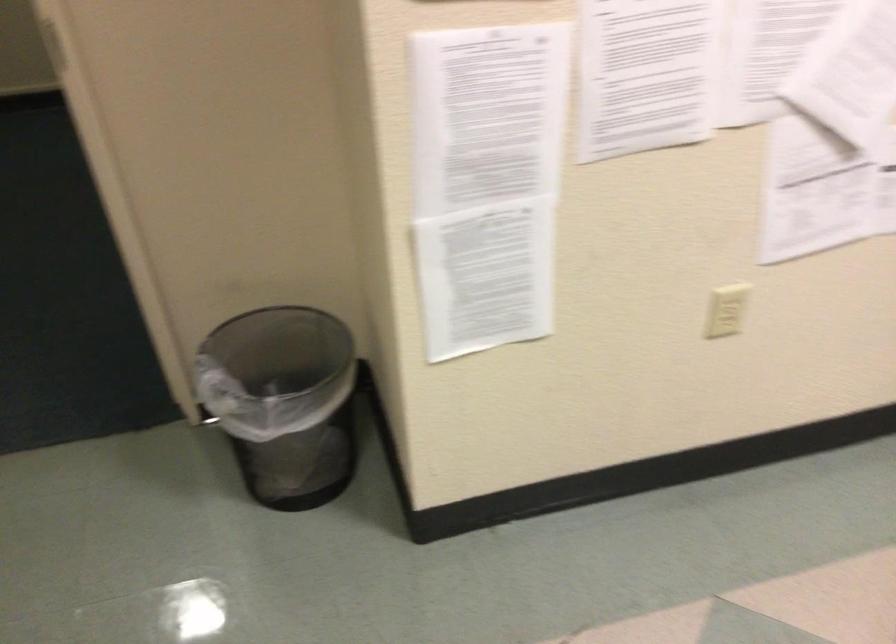
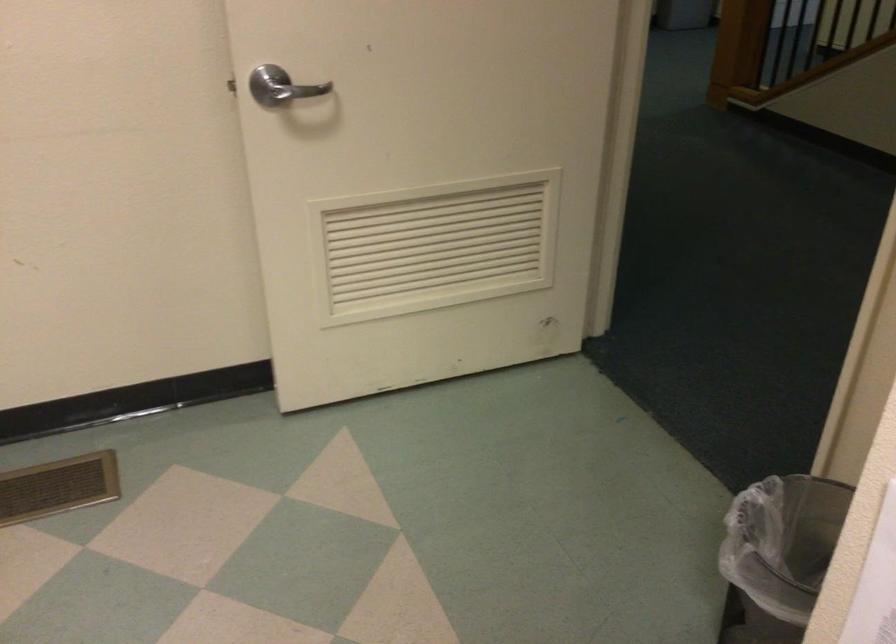
Locate, in the second image, the point that corresponds to (255,400) in the first image.

(778, 556)